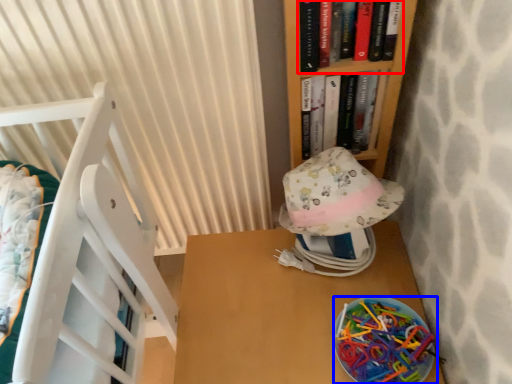
Question: Which object appears closest to the camera in this image, book (highlighted by a red box) or stuff (highlighted by a blue box)?

Choices:
 (A) book
 (B) stuff

Answer: (A)